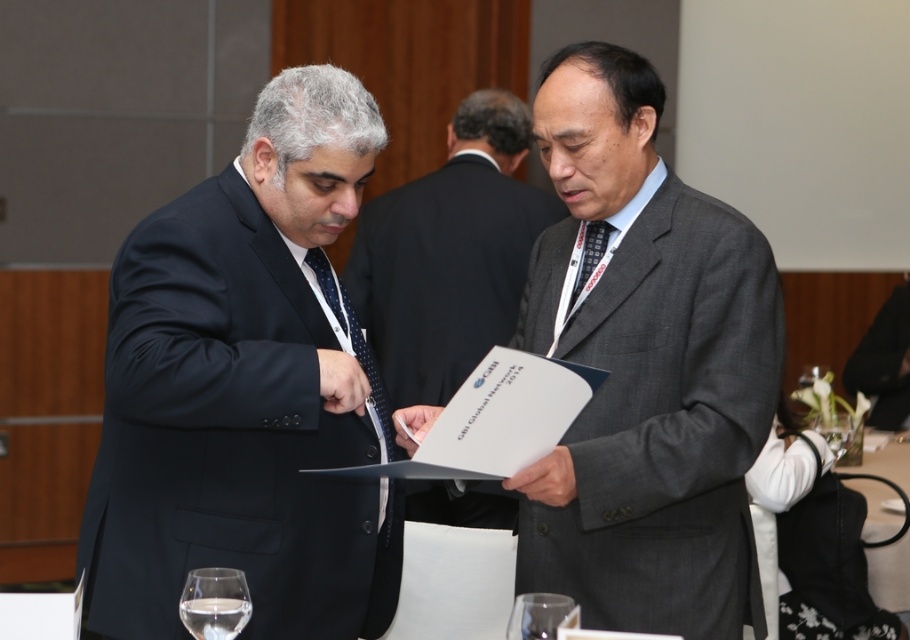
You are an event planner organizing a seating arrangement for a dinner. You need to seat the matte black suit at left and the matte gray suit at center such that they are not sitting next to each other. Given their current positions in the image, where should you place them to ensure they are separated?

The matte black suit at left is positioned on the left side of matte gray suit at center. To ensure they are not sitting next to each other, place the matte black suit at left at one end of the table and the matte gray suit at center somewhere in the middle or the opposite end.